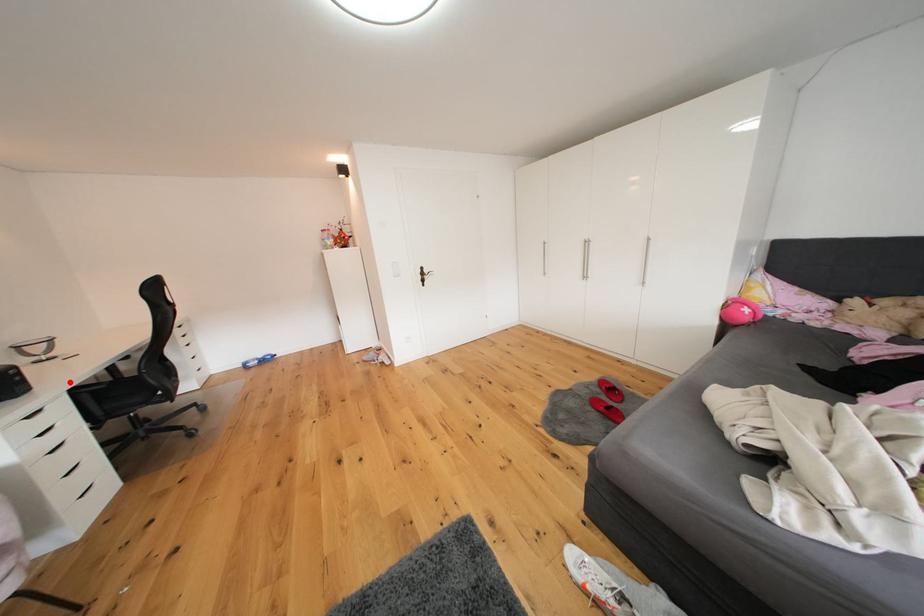
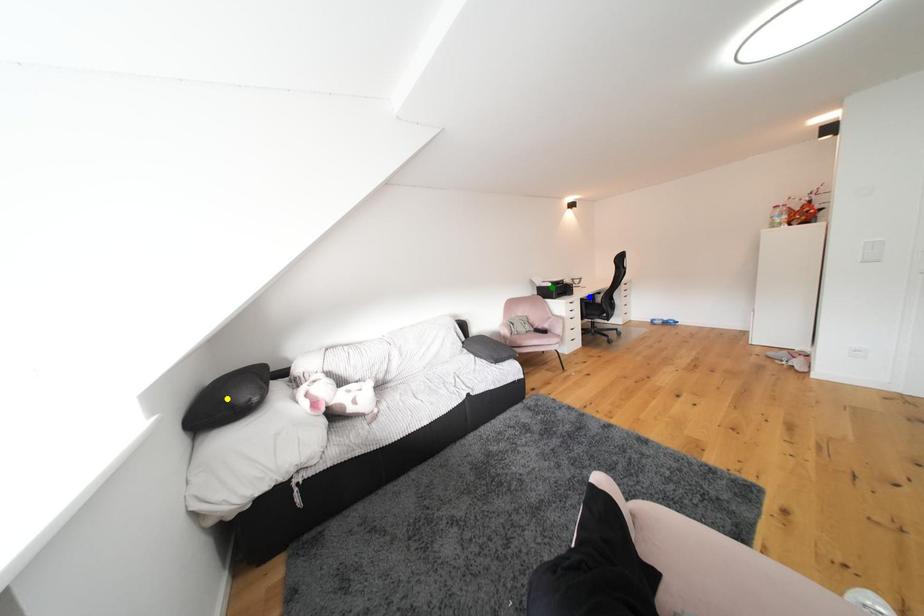
Question: I am providing you with two images of the same scene from different viewpoints. A red point is marked on the first image. You are given multiple points on the second image. Which point in image 2 is actually the same real-world point as the red point in image 1?

Choices:
 (A) yellow point
 (B) green point
 (C) blue point

Answer: (C)